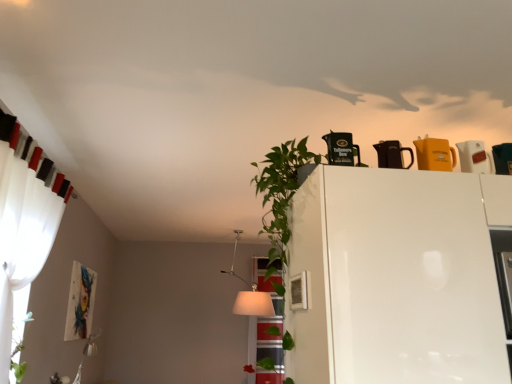
Describe the element at coordinates (474, 157) in the screenshot. The height and width of the screenshot is (384, 512). I see `white glossy pitcher at upper right, which ranks as the first appliance in right-to-left order` at that location.

In order to face white sheer curtain at left, should I rotate leftwards or rightwards?

You should look left and rotate roughly 28.799 degrees.

In order to face yellow matte pitcher at upper right, the 3th appliance from the left, should I rotate leftwards or rightwards?

You should rotate right by 23.092 degrees.

Measure the distance between translucent glass window at center and camera.

4.12 meters.

The height and width of the screenshot is (384, 512). Identify the location of white glossy fridge at upper center. (394, 280).

Find the location of `white glossy pitcher at upper right, which ranks as the first appliance in right-to-left order`. white glossy pitcher at upper right, which ranks as the first appliance in right-to-left order is located at coordinates (474, 157).

Which object is positioned more to the left, yellow matte pitcher at upper right, acting as the second appliance starting from the right, or white glossy pitcher at upper right, which ranks as the first appliance in right-to-left order?

→ From the viewer's perspective, yellow matte pitcher at upper right, acting as the second appliance starting from the right, appears more on the left side.

From the image's perspective, is yellow matte pitcher at upper right, the 3th appliance from the left, over white glossy pitcher at upper right, placed as the fourth appliance when sorted from left to right?

Yes, from the image's perspective, yellow matte pitcher at upper right, the 3th appliance from the left, is over white glossy pitcher at upper right, placed as the fourth appliance when sorted from left to right.

Is yellow matte pitcher at upper right, the 3th appliance from the left, aimed at white glossy pitcher at upper right, which ranks as the first appliance in right-to-left order?

No, yellow matte pitcher at upper right, the 3th appliance from the left, is not aimed at white glossy pitcher at upper right, which ranks as the first appliance in right-to-left order.

What's the angular difference between yellow matte pitcher at upper right, acting as the second appliance starting from the right, and matte black kettle at upper center, which ranks as the 3th appliance in right-to-left order,'s facing directions?

There is a 0.00601-degree angle between the facing directions of yellow matte pitcher at upper right, acting as the second appliance starting from the right, and matte black kettle at upper center, which ranks as the 3th appliance in right-to-left order.

Which of these two, yellow matte pitcher at upper right, the 3th appliance from the left, or matte black kettle at upper center, which ranks as the 3th appliance in right-to-left order, is smaller?

With smaller size is matte black kettle at upper center, which ranks as the 3th appliance in right-to-left order.

Is yellow matte pitcher at upper right, acting as the second appliance starting from the right, situated inside matte black kettle at upper center, which ranks as the 3th appliance in right-to-left order, or outside?

yellow matte pitcher at upper right, acting as the second appliance starting from the right, lies outside matte black kettle at upper center, which ranks as the 3th appliance in right-to-left order.

From the picture: Is yellow matte pitcher at upper right, acting as the second appliance starting from the right, beside matte black kettle at upper center, which is counted as the 2th appliance, starting from the left?

Yes, yellow matte pitcher at upper right, acting as the second appliance starting from the right, is beside matte black kettle at upper center, which is counted as the 2th appliance, starting from the left.

Can you confirm if white fabric lampshade at center is positioned to the right of matte black kettle at upper center, which is counted as the 2th appliance, starting from the left?

No.

Is white fabric lampshade at center spatially inside matte black kettle at upper center, which ranks as the 3th appliance in right-to-left order, or outside of it?

white fabric lampshade at center is outside matte black kettle at upper center, which ranks as the 3th appliance in right-to-left order.

Who is smaller, white fabric lampshade at center or matte black kettle at upper center, which ranks as the 3th appliance in right-to-left order?

matte black kettle at upper center, which ranks as the 3th appliance in right-to-left order, is smaller.

Considering the relative sizes of translucent glass window at center and matte black kettle at upper center, which ranks as the 3th appliance in right-to-left order, in the image provided, is translucent glass window at center bigger than matte black kettle at upper center, which ranks as the 3th appliance in right-to-left order,?

Yes.

Is translucent glass window at center far from matte black kettle at upper center, which ranks as the 3th appliance in right-to-left order?

Yes, translucent glass window at center and matte black kettle at upper center, which ranks as the 3th appliance in right-to-left order, are quite far apart.

Which object is thinner, translucent glass window at center or matte black kettle at upper center, which is counted as the 2th appliance, starting from the left?

Thinner between the two is matte black kettle at upper center, which is counted as the 2th appliance, starting from the left.

Is translucent glass window at center aimed at matte black kettle at upper center, which ranks as the 3th appliance in right-to-left order?

Yes, translucent glass window at center is turned towards matte black kettle at upper center, which ranks as the 3th appliance in right-to-left order.

From a real-world perspective, is white glossy fridge at upper center located beneath black plastic coffee pot at upper center, arranged as the 4th appliance when viewed from the right?

Yes, from a real-world perspective, white glossy fridge at upper center is below black plastic coffee pot at upper center, arranged as the 4th appliance when viewed from the right.

Where is `the 1st appliance behind the white glossy fridge at upper center`? The height and width of the screenshot is (384, 512). the 1st appliance behind the white glossy fridge at upper center is located at coordinates (341, 149).

Considering the relative positions of white glossy fridge at upper center and black plastic coffee pot at upper center, arranged as the 4th appliance when viewed from the right, in the image provided, is white glossy fridge at upper center to the left or to the right of black plastic coffee pot at upper center, arranged as the 4th appliance when viewed from the right,?

Based on their positions, white glossy fridge at upper center is located to the right of black plastic coffee pot at upper center, arranged as the 4th appliance when viewed from the right.

From the image's perspective, which object appears higher, white glossy fridge at upper center or black plastic coffee pot at upper center, arranged as the 4th appliance when viewed from the right?

From the image's view, black plastic coffee pot at upper center, arranged as the 4th appliance when viewed from the right, is above.

Consider the image. Who is taller, matte black kettle at upper center, which is counted as the 2th appliance, starting from the left, or translucent glass window at center?

translucent glass window at center is taller.

What's the angular difference between matte black kettle at upper center, which is counted as the 2th appliance, starting from the left, and translucent glass window at center's facing directions?

They differ by 3.64 degrees in their facing directions.

Is matte black kettle at upper center, which ranks as the 3th appliance in right-to-left order, not near translucent glass window at center?

Absolutely, matte black kettle at upper center, which ranks as the 3th appliance in right-to-left order, is distant from translucent glass window at center.

From a real-world perspective, which object rests below the other?

translucent glass window at center, from a real-world perspective.

From a real-world perspective, is white sheer curtain at left positioned under black plastic coffee pot at upper center, which is the first appliance in left-to-right order, based on gravity?

Correct, in the physical world, white sheer curtain at left is lower than black plastic coffee pot at upper center, which is the first appliance in left-to-right order.

This screenshot has width=512, height=384. I want to click on curtain below the black plastic coffee pot at upper center, arranged as the 4th appliance when viewed from the right (from a real-world perspective), so click(23, 225).

How different are the orientations of white sheer curtain at left and black plastic coffee pot at upper center, arranged as the 4th appliance when viewed from the right, in degrees?

96.1 degrees.

Does white sheer curtain at left turn towards black plastic coffee pot at upper center, arranged as the 4th appliance when viewed from the right?

Yes.

This screenshot has height=384, width=512. What are the coordinates of `appliance that is the 2nd object located in front of the white glossy pitcher at upper right, placed as the fourth appliance when sorted from left to right` in the screenshot? It's located at (435, 154).

The image size is (512, 384). What are the coordinates of `the 1st appliance behind the yellow matte pitcher at upper right, acting as the second appliance starting from the right, counting from the anchor's position` in the screenshot? It's located at point(392,154).

Based on the photo, from the image, which object appears to be nearer to white glossy fridge at upper center, white fabric lampshade at center or white sheer curtain at left?

The object closer to white glossy fridge at upper center is white sheer curtain at left.

Which object lies nearer to the anchor point white fabric lampshade at center, white glossy fridge at upper center or white glossy pitcher at upper right, placed as the fourth appliance when sorted from left to right?

white glossy fridge at upper center.

From the image, which object appears to be nearer to white sheer curtain at left, black plastic coffee pot at upper center, which is the first appliance in left-to-right order, or white fabric lampshade at center?

The object closer to white sheer curtain at left is black plastic coffee pot at upper center, which is the first appliance in left-to-right order.

When comparing their distances from yellow matte pitcher at upper right, the 3th appliance from the left, does white glossy fridge at upper center or matte black kettle at upper center, which is counted as the 2th appliance, starting from the left, seem further?

Based on the image, white glossy fridge at upper center appears to be further to yellow matte pitcher at upper right, the 3th appliance from the left.

From the picture: Which object lies further to the anchor point yellow matte pitcher at upper right, the 3th appliance from the left, matte black kettle at upper center, which is counted as the 2th appliance, starting from the left, or black plastic coffee pot at upper center, which is the first appliance in left-to-right order?

Among the two, black plastic coffee pot at upper center, which is the first appliance in left-to-right order, is located further to yellow matte pitcher at upper right, the 3th appliance from the left.

Considering their positions, is white fabric lampshade at center positioned closer to white sheer curtain at left than yellow matte pitcher at upper right, acting as the second appliance starting from the right?

yellow matte pitcher at upper right, acting as the second appliance starting from the right, lies closer to white sheer curtain at left than the other object.

Which object lies nearer to the anchor point yellow matte pitcher at upper right, acting as the second appliance starting from the right, black plastic coffee pot at upper center, arranged as the 4th appliance when viewed from the right, or translucent glass window at center?

Among the two, black plastic coffee pot at upper center, arranged as the 4th appliance when viewed from the right, is located nearer to yellow matte pitcher at upper right, acting as the second appliance starting from the right.

Looking at the image, which one is located further to white fabric lampshade at center, white sheer curtain at left or white glossy fridge at upper center?

white glossy fridge at upper center is positioned further to the anchor white fabric lampshade at center.

Locate an element on the screen. The image size is (512, 384). lamp positioned between black plastic coffee pot at upper center, arranged as the 4th appliance when viewed from the right, and translucent glass window at center from near to far is located at coordinates (250, 294).

At what (x,y) coordinates should I click in order to perform the action: click on appliance located between matte black kettle at upper center, which ranks as the 3th appliance in right-to-left order, and translucent glass window at center in the depth direction. Please return your answer as a coordinate pair (x, y). This screenshot has height=384, width=512. Looking at the image, I should click on (474, 157).

This screenshot has width=512, height=384. Find the location of `lamp between yellow matte pitcher at upper right, acting as the second appliance starting from the right, and translucent glass window at center from front to back`. lamp between yellow matte pitcher at upper right, acting as the second appliance starting from the right, and translucent glass window at center from front to back is located at coordinates (250, 294).

The image size is (512, 384). I want to click on appliance situated between white sheer curtain at left and white glossy fridge at upper center from left to right, so click(341, 149).